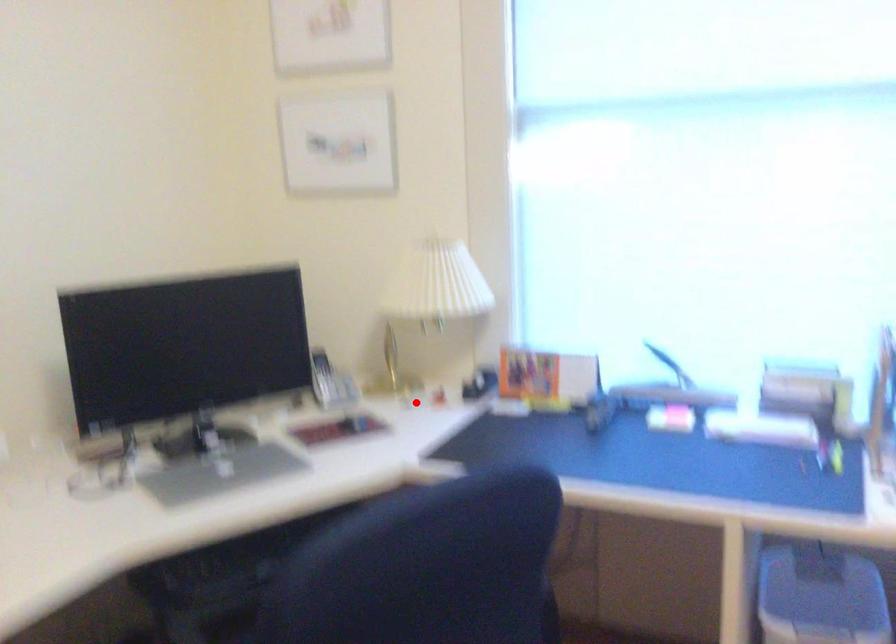
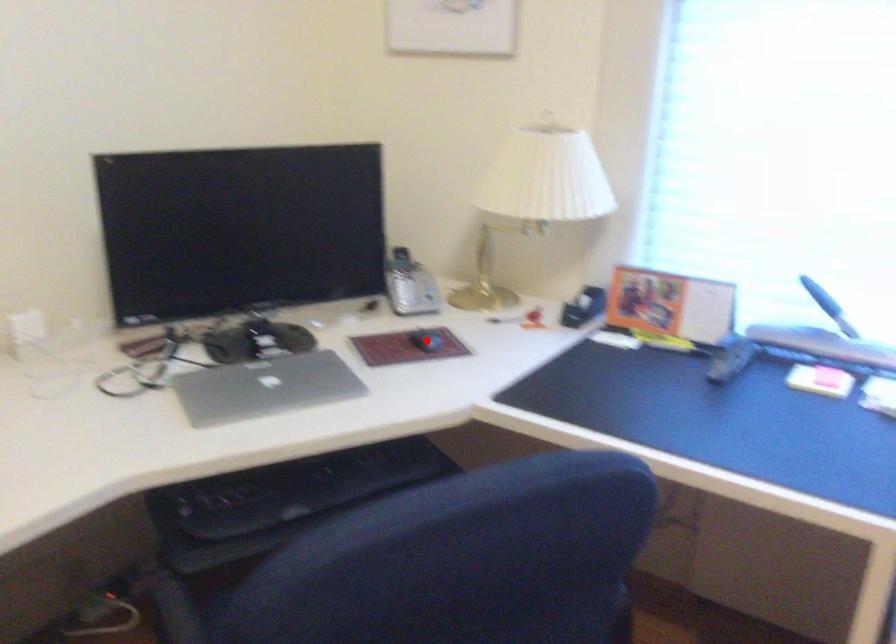
I am providing you with two images of the same scene from different viewpoints. A red point is marked on the first image and another point is marked on the second image. Are the points marked in image1 and image2 representing the same 3D position?

No